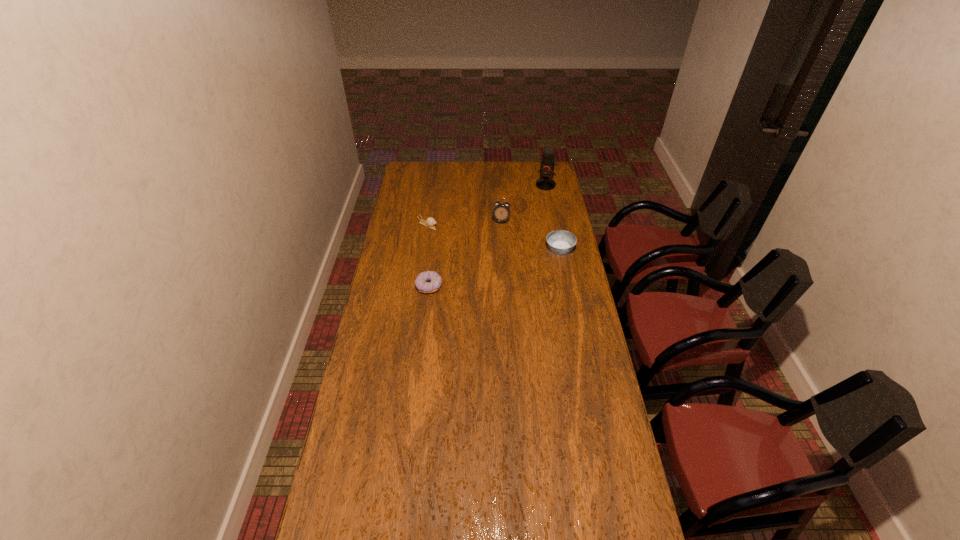
Find the location of a particular element. The image size is (960, 540). doughnut is located at coordinates (426, 282).

Find the location of a particular element. the fourth farthest object is located at coordinates (559, 241).

I want to click on ashtray, so click(559, 241).

At what (x,y) coordinates should I click in order to perform the action: click on the tallest object. Please return your answer as a coordinate pair (x, y). The height and width of the screenshot is (540, 960). Looking at the image, I should click on (547, 162).

The height and width of the screenshot is (540, 960). What are the coordinates of `the farthest object` in the screenshot? It's located at (547, 162).

Find the location of a particular element. The width and height of the screenshot is (960, 540). escargot is located at coordinates (430, 222).

Where is `the second tallest object`? the second tallest object is located at coordinates (501, 212).

Image resolution: width=960 pixels, height=540 pixels. I want to click on alarm clock, so click(x=501, y=212).

At what (x,y) coordinates should I click in order to perform the action: click on free space located on the front of the nearest object. Please return your answer as a coordinate pair (x, y). Image resolution: width=960 pixels, height=540 pixels. Looking at the image, I should click on (426, 307).

Image resolution: width=960 pixels, height=540 pixels. I want to click on vacant space positioned 0.120m on the back of the second nearest object, so click(555, 225).